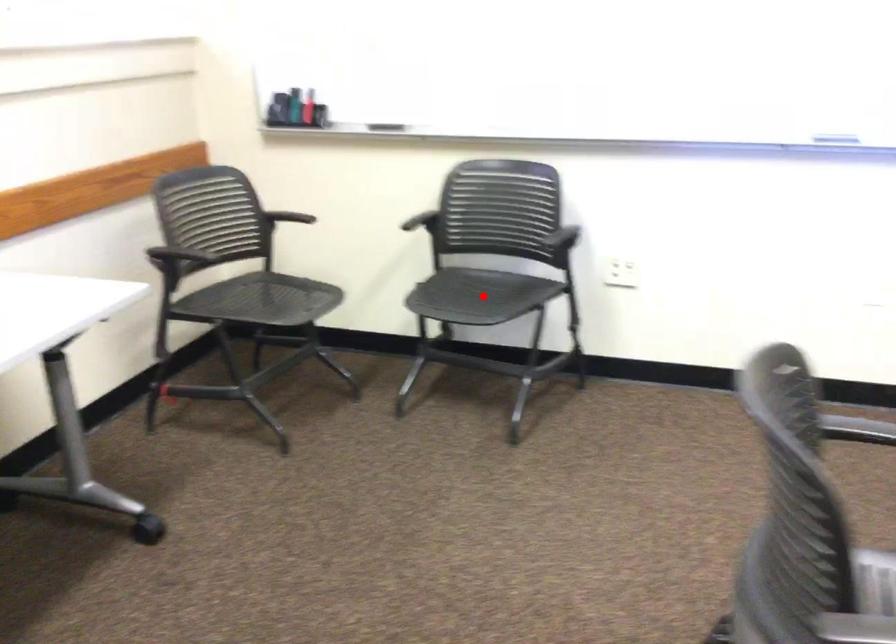
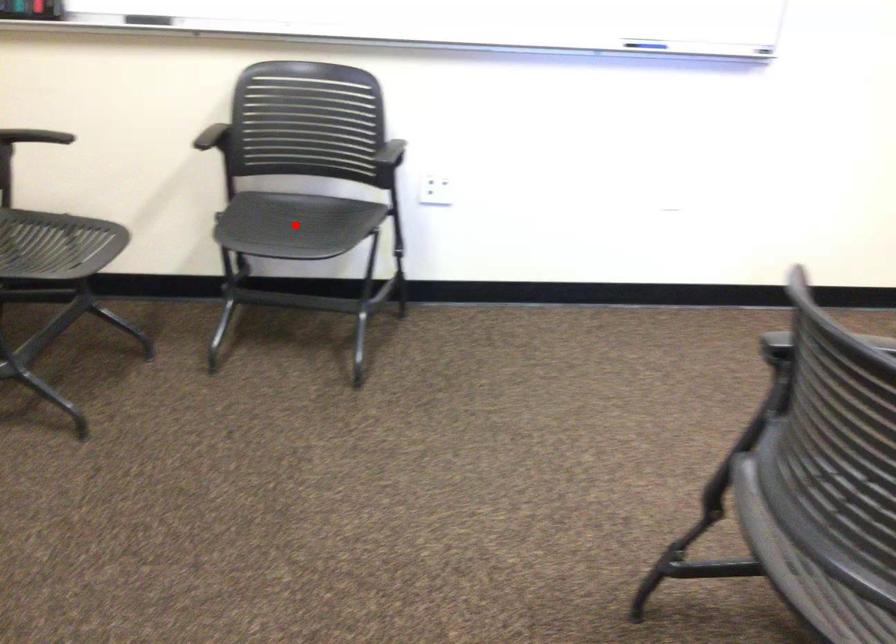
I am providing you with two images of the same scene from different viewpoints. A red point is marked on the first image and another point is marked on the second image. Are the points marked in image1 and image2 representing the same 3D position?

Yes